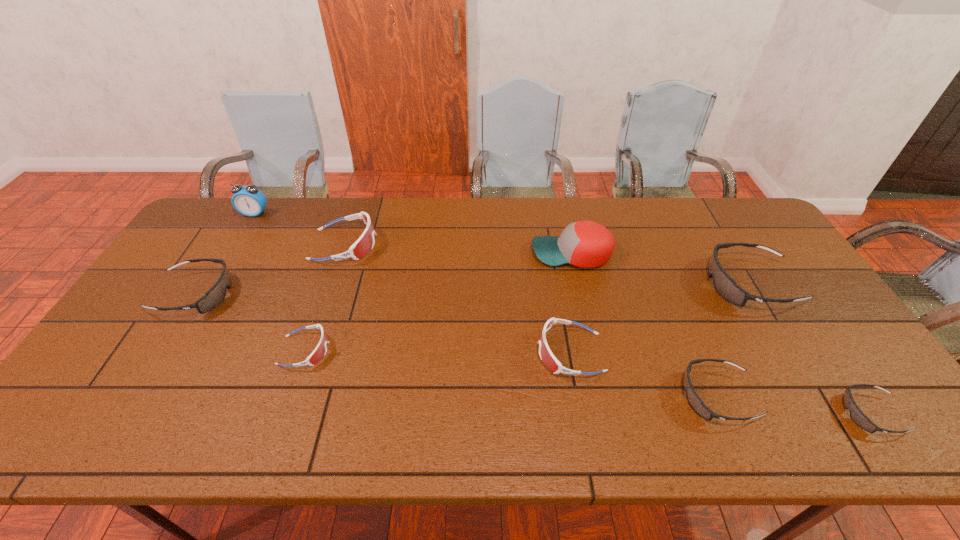
The width and height of the screenshot is (960, 540). Find the location of `black goggles that stands as the second closest to the third goggles from right to left`. black goggles that stands as the second closest to the third goggles from right to left is located at coordinates (857, 416).

Where is `the closest black goggles to the third black goggles from right to left`? the closest black goggles to the third black goggles from right to left is located at coordinates (725, 286).